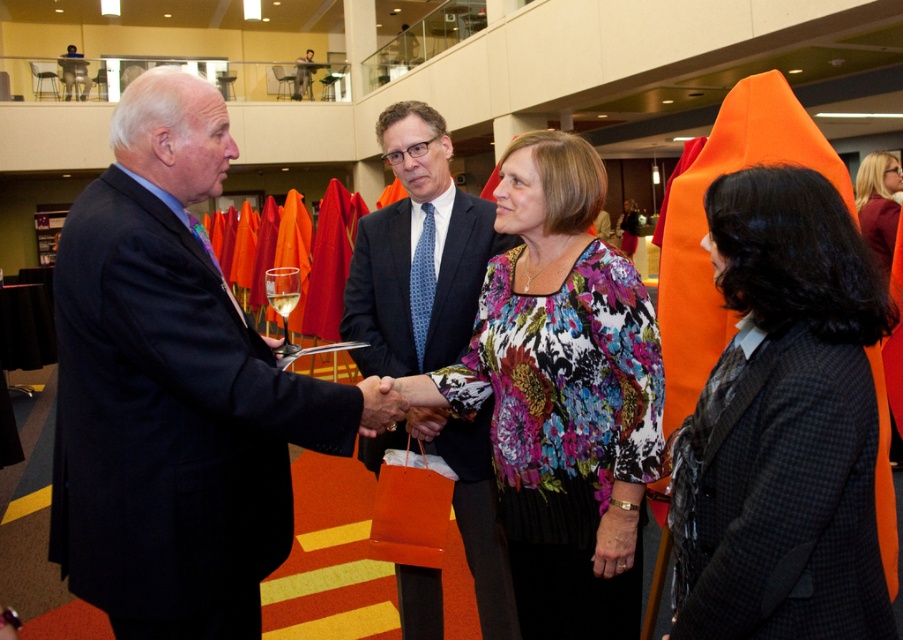
Question: Estimate the real-world distances between objects in this image. Which object is closer to the blue dotted tie at center?

Choices:
 (A) dark suit at left
 (B) black textured blazer at right
 (C) floral print blouse at center
 (D) black textured hair at upper right

Answer: (C)

Question: Does dark suit at left appear on the left side of black textured blazer at right?

Choices:
 (A) no
 (B) yes

Answer: (B)

Question: Which object appears farthest from the camera in this image?

Choices:
 (A) floral print blouse at center
 (B) black textured blazer at right
 (C) dark suit at left

Answer: (A)

Question: Which object is closer to the camera taking this photo?

Choices:
 (A) black textured hair at upper right
 (B) floral print blouse at center

Answer: (B)

Question: Is dark suit at left positioned at the back of floral print blouse at center?

Choices:
 (A) no
 (B) yes

Answer: (A)

Question: Can you confirm if black textured blazer at right is wider than blue dotted tie at center?

Choices:
 (A) no
 (B) yes

Answer: (A)